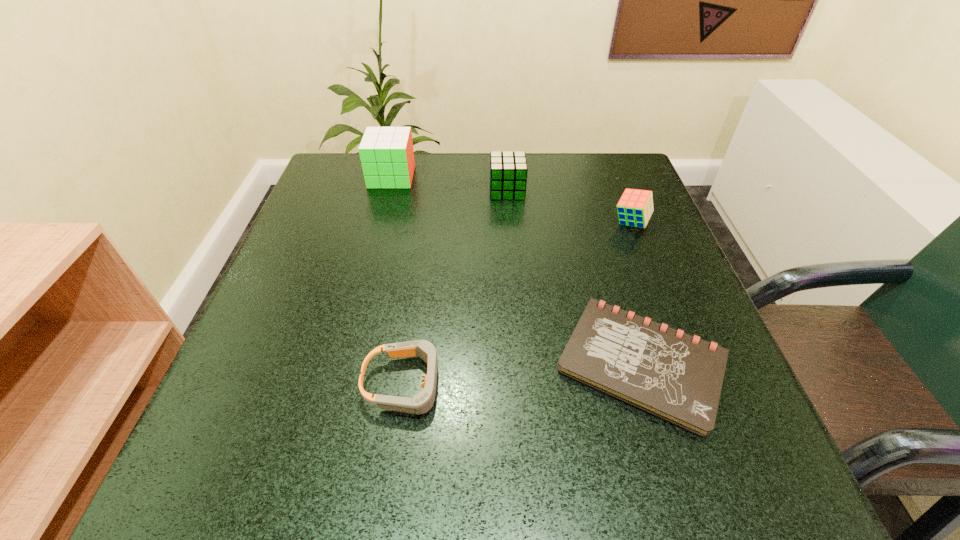
The image size is (960, 540). Identify the location of vacant space that satisfies the following two spatial constraints: 1. on the front side of the shortest object; 2. on the left side of the second cube from right to left. (520, 363).